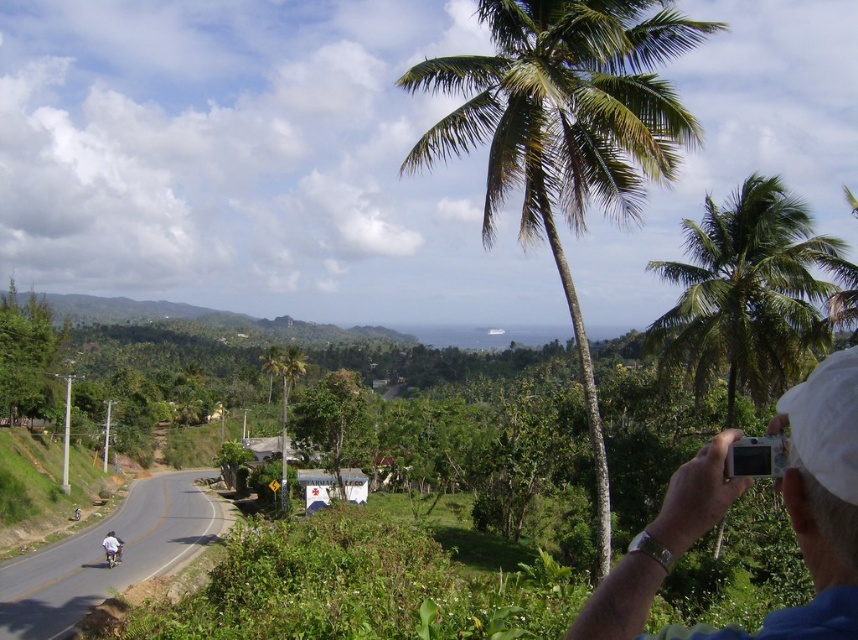
You are a photographer standing at the lower part of the image, holding a camera. You want to capture both the green leafy coconut tree at upper center and the green leafy coconut tree at upper right in your photo. Which tree should you zoom in more on to ensure both are visible in the frame?

You should zoom in more on the green leafy coconut tree at upper right because it is narrower than the green leafy coconut tree at upper center, allowing you to fit both trees within the frame by adjusting the focal length to accommodate their differing widths.

You are a photographer standing at the scene. You notice the green leafy coconut tree at upper center and the white fabric helmet at lower left. Which object is larger in size?

The green leafy coconut tree at upper center is bigger than the white fabric helmet at lower left.